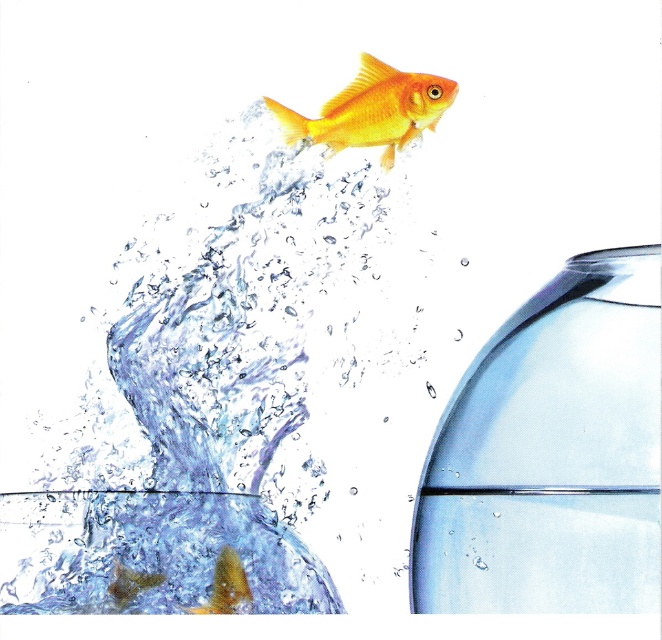
You are holding a net to catch the shiny gold fish at upper center. The net is 10 cm wide. The translucent glass water at upper center is in the way. Can you reach the fish without disturbing the water?

The translucent glass water at upper center is closer to the viewer than the shiny gold fish at upper center, so you can reach the fish by moving the net through the water, but you will disturb the water in the process.

You are observing the fishbowl and the goldfish in the scene. If you were to draw a line from the point at the fishbowl edge at point (97, 420) to the point at the goldfish tail at point (375, 131), which point would appear closer to you?

The point at the fishbowl edge at (97, 420) is closer to the viewer than the point at the goldfish tail at (375, 131).

You are holding a camera and want to take a closeup shot of the goldfish in the fishbowl. The camera is currently focused on the point at coordinates point (299, 561). Is this point close enough to capture the goldfish clearly?

The point (299, 561) is 7.65 inches away from the camera, so yes, this distance is close enough to capture the goldfish clearly.